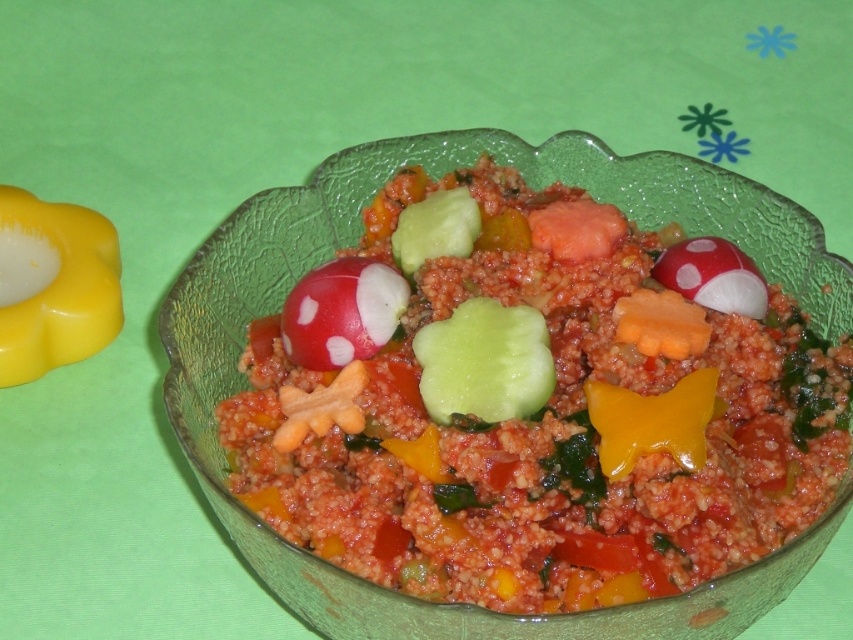
This screenshot has height=640, width=853. What do you see at coordinates (538, 429) in the screenshot? I see `smooth red radish at center` at bounding box center [538, 429].

This screenshot has width=853, height=640. In order to click on smooth red radish at center in this screenshot , I will do `click(538, 429)`.